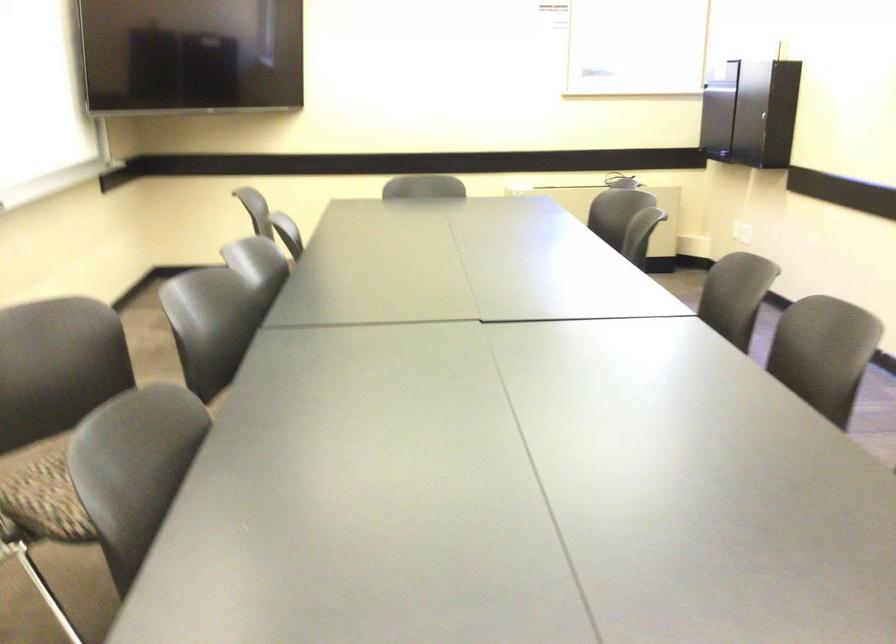
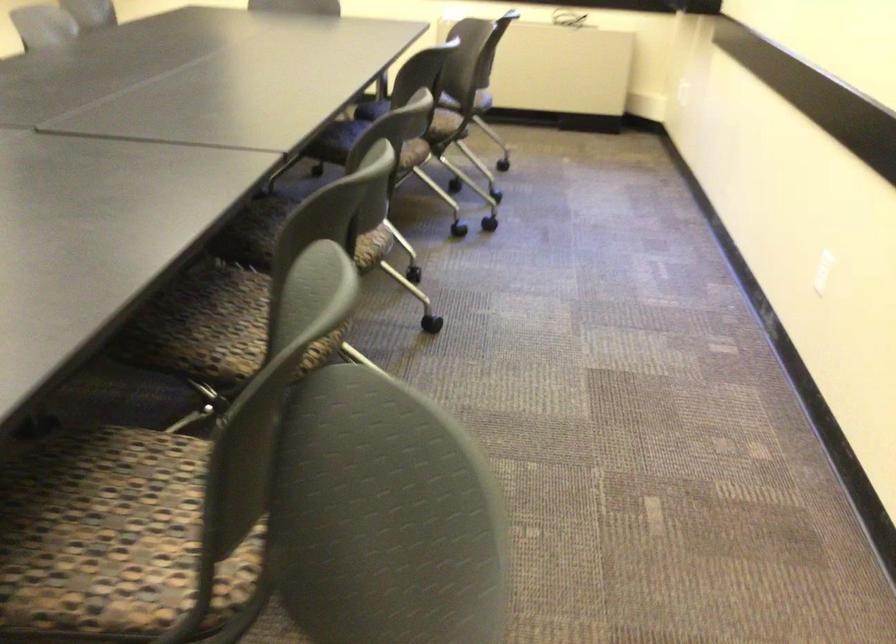
In the second image, find the point that corresponds to the point at 733,223 in the first image.

(682, 90)